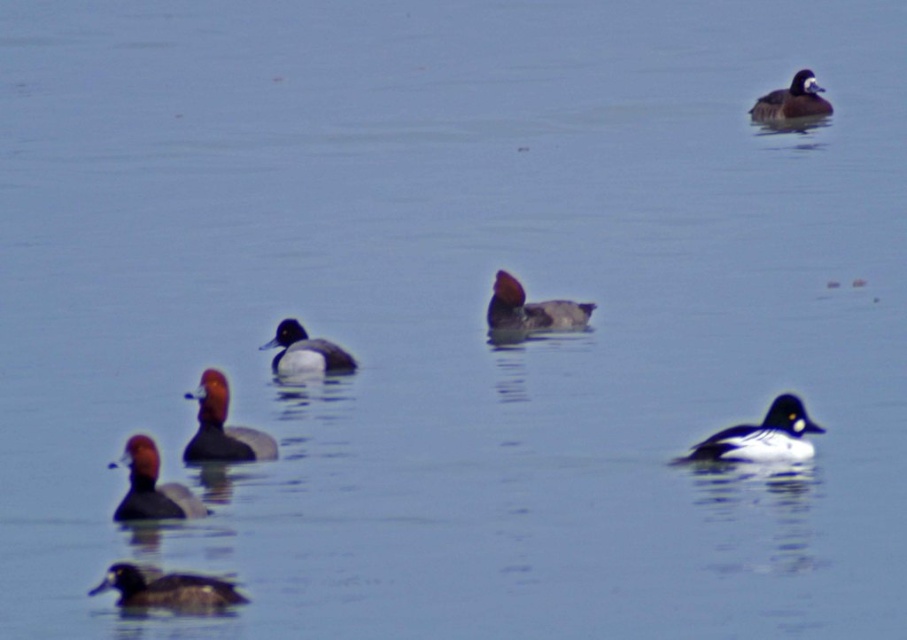
Question: Does white glossy duck at right appear under dark brown duck at lower left?

Choices:
 (A) yes
 (B) no

Answer: (B)

Question: Which point is closer to the camera?

Choices:
 (A) dark brown duck at lower left
 (B) brown matte duck at center-left
 (C) white glossy duck at right
 (D) brown matte duck at center

Answer: (A)

Question: Does brown matte duck at center-left have a smaller size compared to brown matte duck at lower left?

Choices:
 (A) yes
 (B) no

Answer: (B)

Question: Which of the following is the closest to the observer?

Choices:
 (A) [x=289, y=337]
 (B) [x=821, y=86]
 (C) [x=244, y=442]
 (D) [x=704, y=456]

Answer: (D)

Question: Does dark brown duck at lower left have a greater width compared to brown matte duck at center-left?

Choices:
 (A) no
 (B) yes

Answer: (B)

Question: Which object is closer to the camera taking this photo?

Choices:
 (A) brown matte duck at center
 (B) dark brown duck at lower left
 (C) white glossy duck at center

Answer: (B)